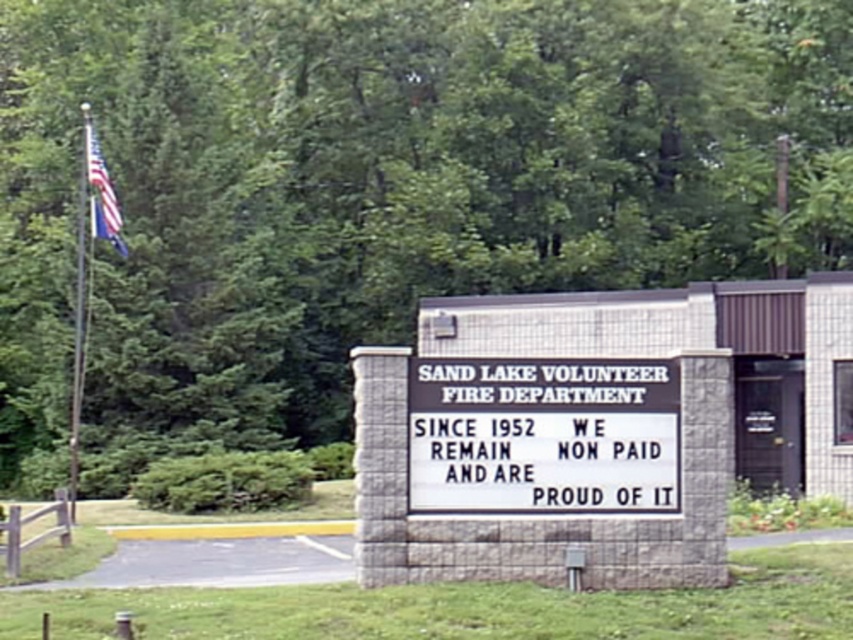
You are a visitor standing at the entrance of the Sand Lake Volunteer Fire Department. You want to take a photo of both the white plastic sign at center and the american flag at upper left in the same frame. Given that your camera can capture a maximum distance of 40 feet between objects, will you be able to include both in a single photo?

The distance between the white plastic sign at center and the american flag at upper left is 35.91 feet, which is less than the camera maximum of 40 feet. Therefore, you can include both in a single photo.

Based on the photo, you are standing at the entrance of the Sand Lake Volunteer Fire Department and want to read the message on the white plastic sign at center. Can you read it clearly from your current position?

The white plastic sign at center is 11.42 meters from viewer, so it might be difficult to read the message clearly from that distance unless you have good eyesight or use visual aids.